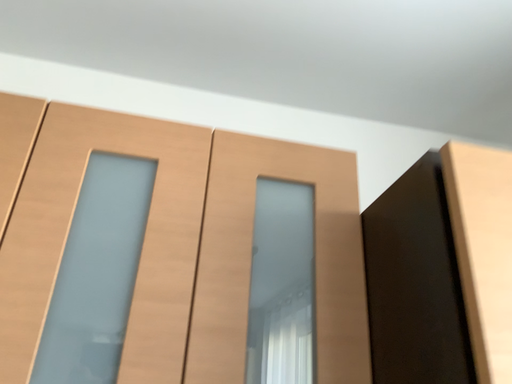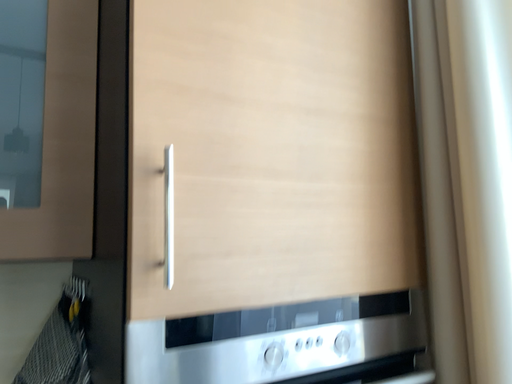
Question: How did the camera likely rotate when shooting the video?

Choices:
 (A) rotated left
 (B) rotated right

Answer: (B)